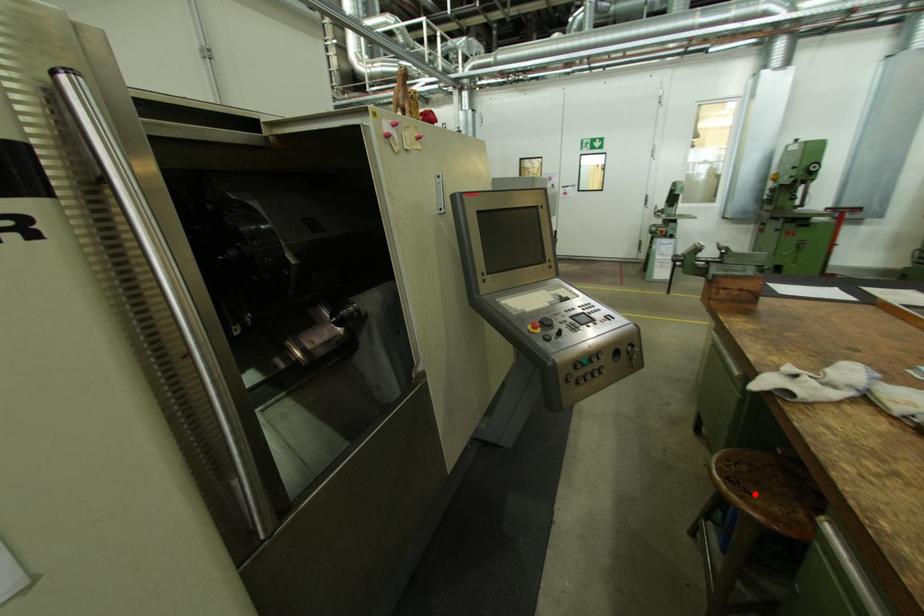
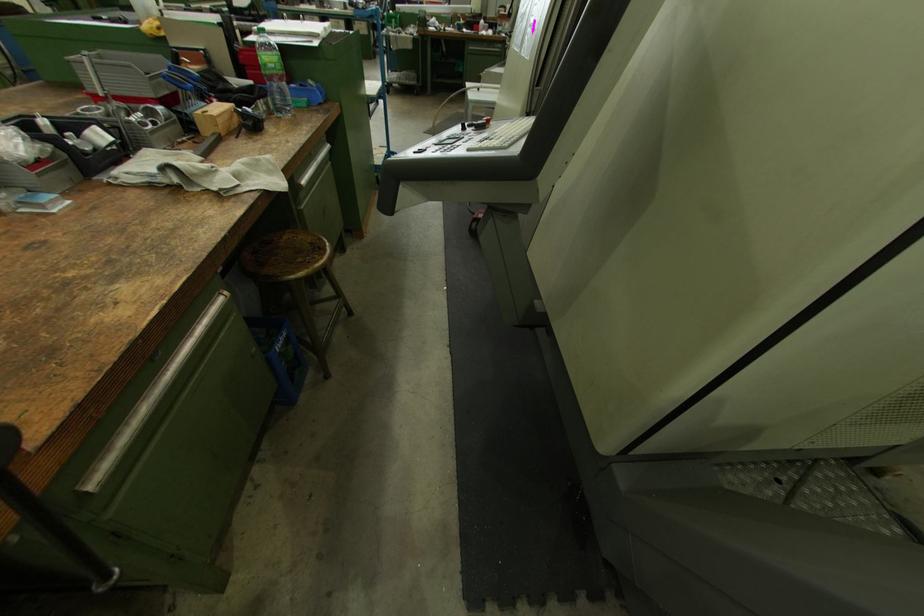
Question: I am providing you with two images of the same scene from different viewpoints. A red point is shown in image1. For the corresponding object point in image2, is it positioned nearer or farther from the camera?

Choices:
 (A) Nearer
 (B) Farther

Answer: (A)